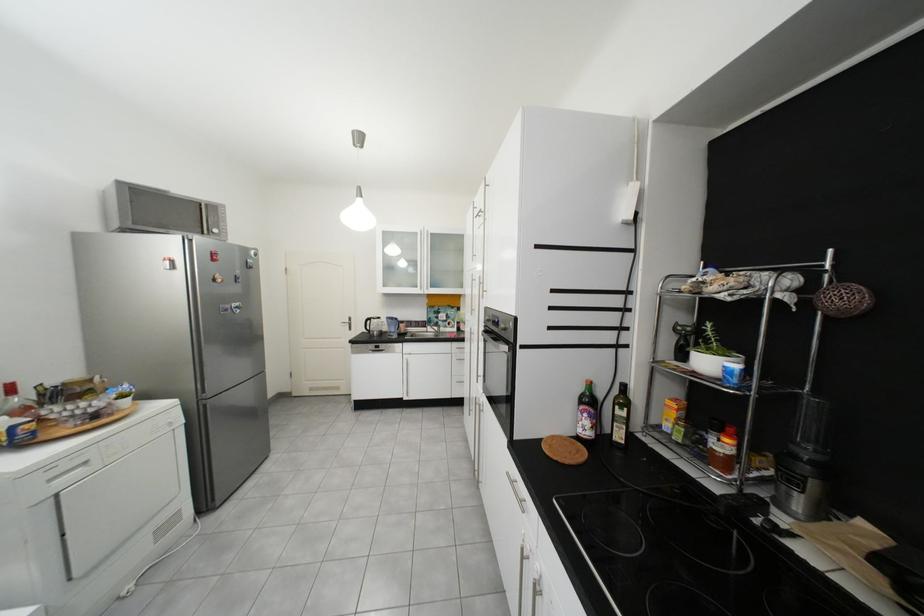
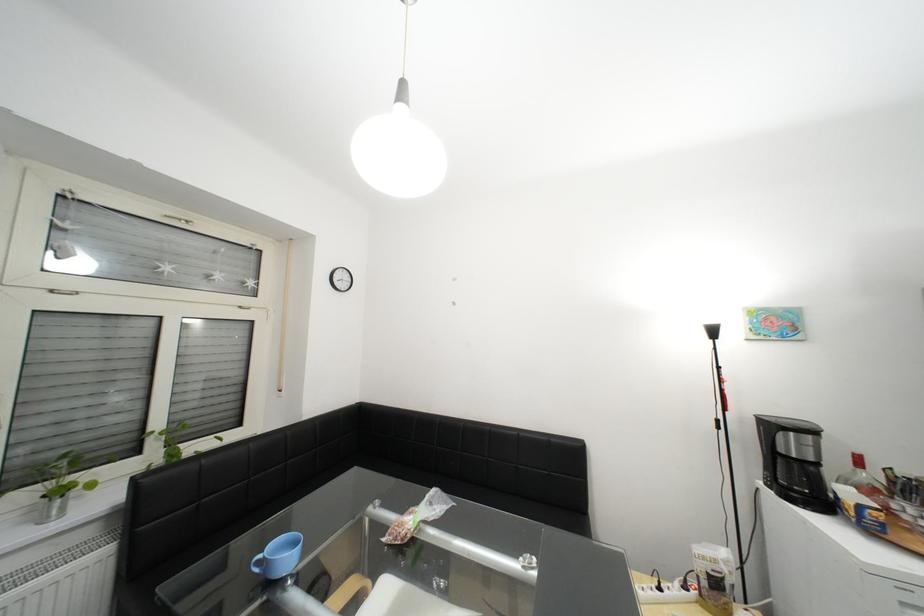
In the second image, find the point that corresponds to (x=38, y=445) in the first image.

(886, 533)